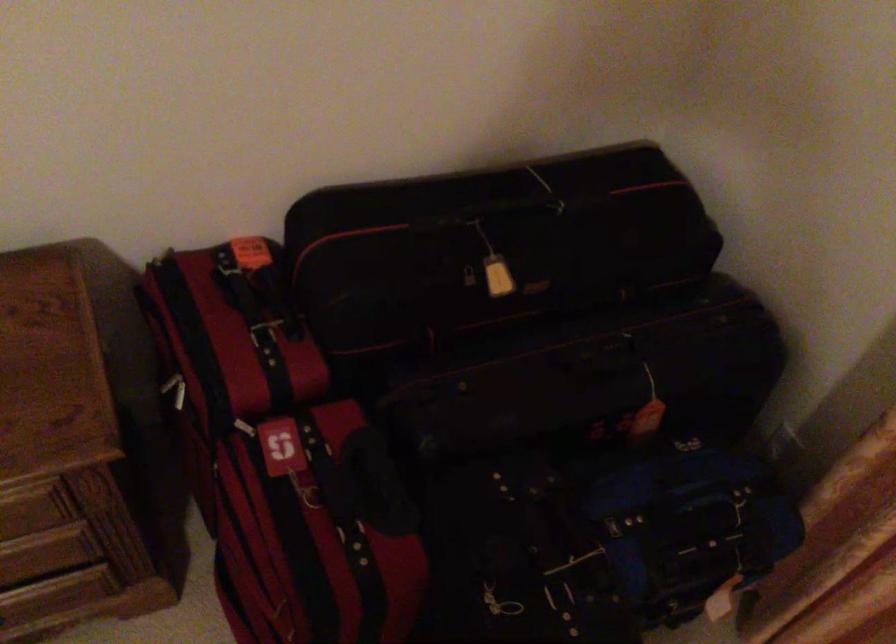
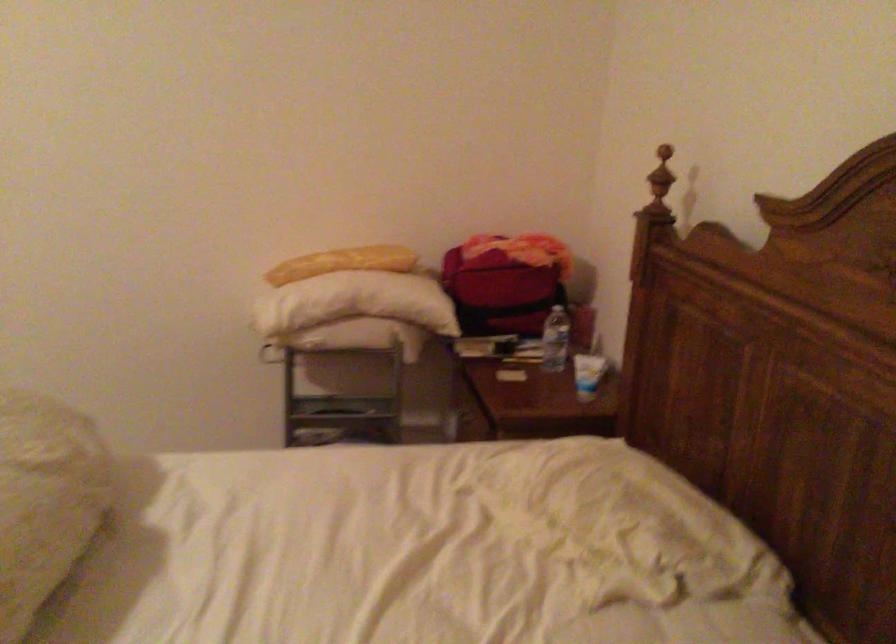
Question: Based on the continuous images, in which direction is the camera rotating? Reply with the corresponding letter.

Choices:
 (A) Left
 (B) Right
 (C) Up
 (D) Down

Answer: (A)